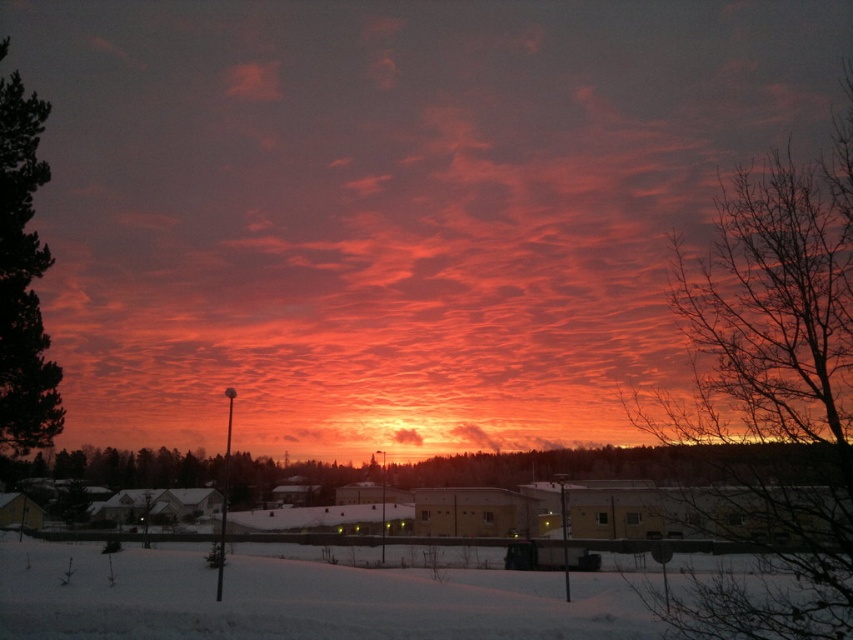
Question: Which point appears farthest from the camera in this image?

Choices:
 (A) (421, 435)
 (B) (776, 499)

Answer: (A)

Question: Can you confirm if green textured pine tree at left is positioned to the left of orange cotton cloud at center?

Choices:
 (A) no
 (B) yes

Answer: (B)

Question: Is matte orange cloud at center to the left of bare branches at upper right from the viewer's perspective?

Choices:
 (A) yes
 (B) no

Answer: (A)

Question: Among these objects, which one is nearest to the camera?

Choices:
 (A) matte orange cloud at center
 (B) bare branches at upper right
 (C) green textured pine tree at left

Answer: (B)

Question: Can you confirm if matte orange cloud at center is positioned above orange cotton cloud at center?

Choices:
 (A) yes
 (B) no

Answer: (A)

Question: Which of the following is the farthest from the observer?

Choices:
 (A) bare branches at upper right
 (B) orange cotton cloud at center
 (C) matte orange cloud at center

Answer: (B)